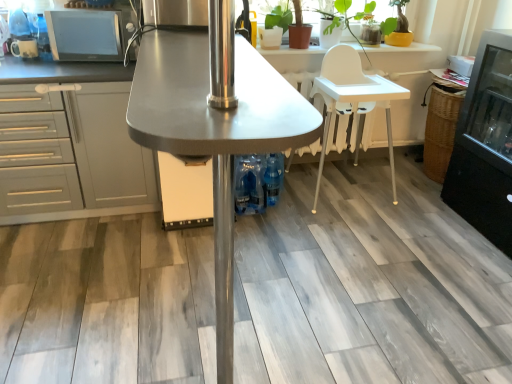
Find the location of a particular element. Image resolution: width=512 pixels, height=384 pixels. vacant space in white plastic chair at center (from a real-world perspective) is located at coordinates (339, 193).